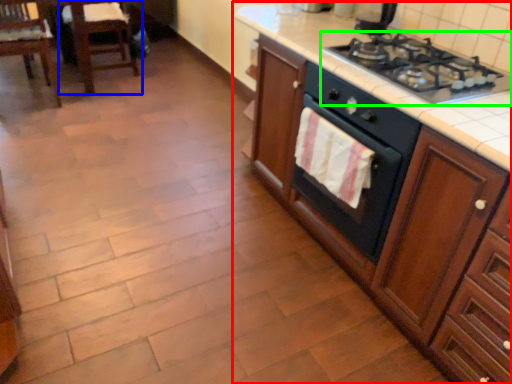
Question: Which object is the farthest from cabinetry (highlighted by a red box)? Choose among these: chair (highlighted by a blue box) or gas stove (highlighted by a green box).

Choices:
 (A) chair
 (B) gas stove

Answer: (A)